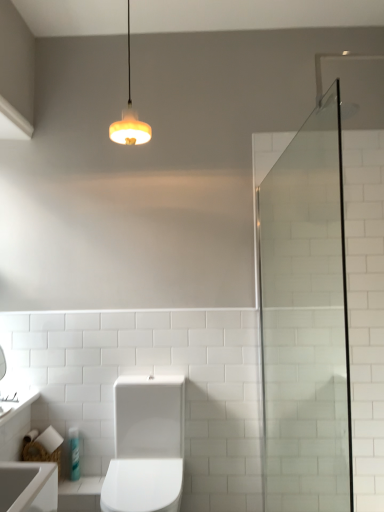
Question: Is clear glass shower door at right oriented away from white glossy sink at lower left?

Choices:
 (A) no
 (B) yes

Answer: (A)

Question: Does clear glass shower door at right have a greater height compared to white glossy sink at lower left?

Choices:
 (A) no
 (B) yes

Answer: (B)

Question: Does clear glass shower door at right have a greater width compared to white glossy sink at lower left?

Choices:
 (A) no
 (B) yes

Answer: (B)

Question: From a real-world perspective, is clear glass shower door at right positioned under white glossy sink at lower left based on gravity?

Choices:
 (A) no
 (B) yes

Answer: (A)

Question: Is clear glass shower door at right thinner than white glossy sink at lower left?

Choices:
 (A) no
 (B) yes

Answer: (A)

Question: From a real-world perspective, does clear glass shower door at right stand above white glossy sink at lower left?

Choices:
 (A) yes
 (B) no

Answer: (A)

Question: Is clear glass shower door at right to the left of matte yellow glass pendant light at upper center from the viewer's perspective?

Choices:
 (A) no
 (B) yes

Answer: (A)

Question: Would you say clear glass shower door at right is a long distance from matte yellow glass pendant light at upper center?

Choices:
 (A) yes
 (B) no

Answer: (A)

Question: Is clear glass shower door at right aimed at matte yellow glass pendant light at upper center?

Choices:
 (A) no
 (B) yes

Answer: (A)

Question: From the image's perspective, is clear glass shower door at right under matte yellow glass pendant light at upper center?

Choices:
 (A) yes
 (B) no

Answer: (A)

Question: Does clear glass shower door at right have a greater width compared to matte yellow glass pendant light at upper center?

Choices:
 (A) yes
 (B) no

Answer: (A)

Question: From a real-world perspective, is clear glass shower door at right on top of matte yellow glass pendant light at upper center?

Choices:
 (A) yes
 (B) no

Answer: (B)

Question: From a real-world perspective, is translucent plastic bottle at lower left under clear glass shower door at right?

Choices:
 (A) yes
 (B) no

Answer: (A)